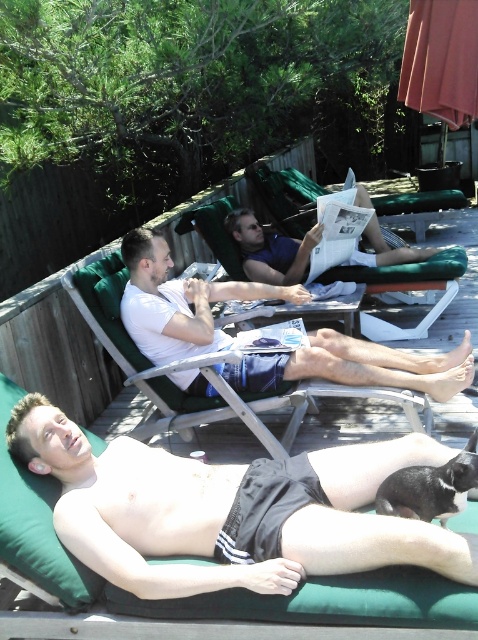
Question: Which point is farther to the camera?

Choices:
 (A) coord(161,451)
 (B) coord(90,608)
 (C) coord(173,282)
 (D) coord(202,220)

Answer: (D)

Question: Is green fabric deck at lower left thinner than blue fabric chair at center?

Choices:
 (A) no
 (B) yes

Answer: (A)

Question: Among these points, which one is nearest to the camera?

Choices:
 (A) (449, 390)
 (B) (343, 458)
 (C) (246, 221)

Answer: (B)

Question: Considering the relative positions of black matte shorts at center and blue fabric chair at center in the image provided, where is black matte shorts at center located with respect to blue fabric chair at center?

Choices:
 (A) below
 (B) above

Answer: (A)

Question: Which of the following is the farthest from the observer?

Choices:
 (A) (191, 476)
 (B) (219, 252)
 (C) (445, 374)
 (D) (299, 269)

Answer: (D)

Question: Is white matte shirt at center above green fabric beach chair at center?

Choices:
 (A) yes
 (B) no

Answer: (B)